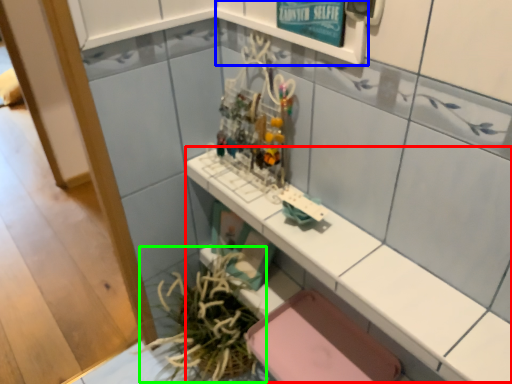
Question: Which object is the closest to the counter top (highlighted by a red box)? Choose among these: shelf (highlighted by a blue box) or plant (highlighted by a green box).

Choices:
 (A) shelf
 (B) plant

Answer: (A)